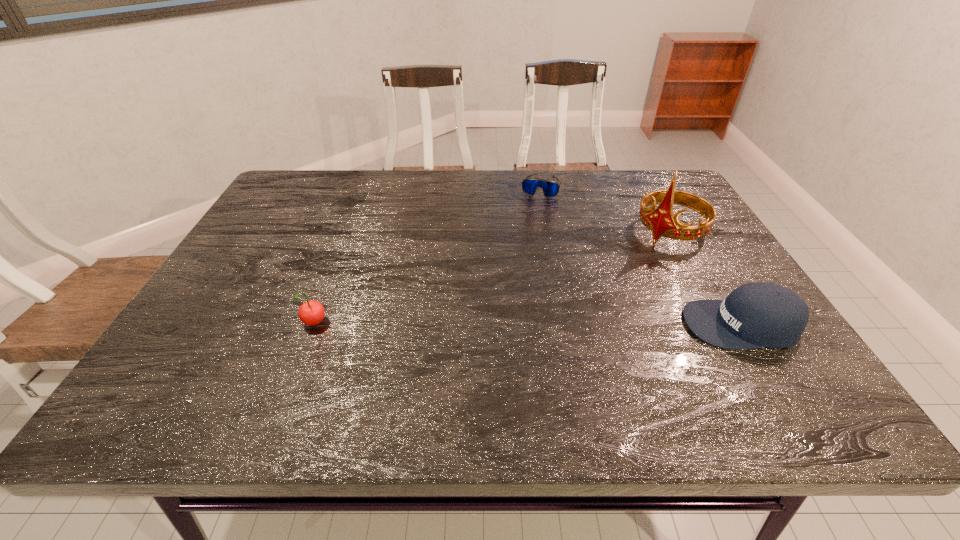
Where is `free space on the desktop that is between the leftmost object and the second shortest object and is positioned on the front-facing side of the third object from right to left`? The height and width of the screenshot is (540, 960). free space on the desktop that is between the leftmost object and the second shortest object and is positioned on the front-facing side of the third object from right to left is located at coordinates (500, 325).

In order to click on vacant spot on the desktop that is between the cherry and the baseball cap and is positioned on the front-facing side of the tallest object in this screenshot , I will do `click(563, 325)`.